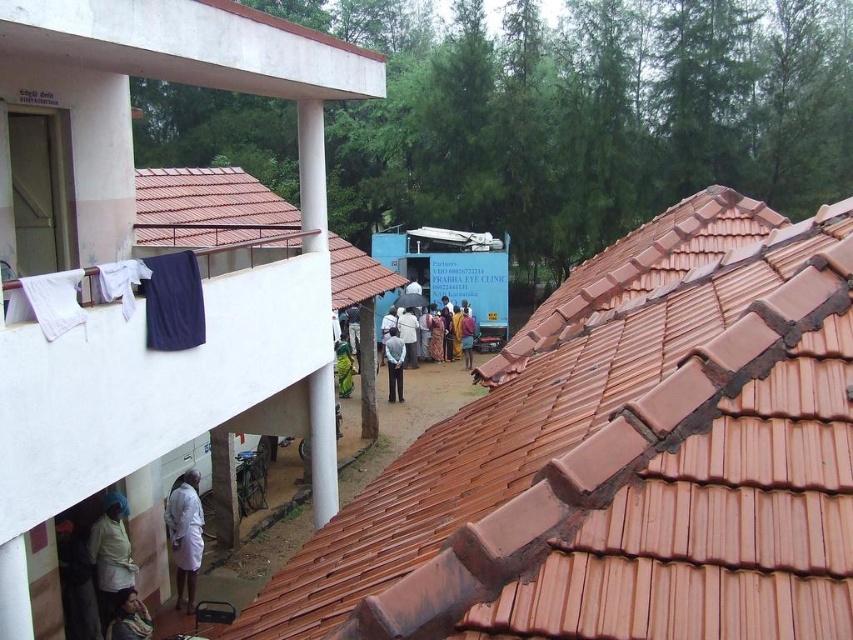
Which of these two, terracotta tile roof at upper left or white cotton dress at lower left, stands taller?

Standing taller between the two is terracotta tile roof at upper left.

Image resolution: width=853 pixels, height=640 pixels. What do you see at coordinates (212, 214) in the screenshot?
I see `terracotta tile roof at upper left` at bounding box center [212, 214].

Between point (252, 204) and point (108, 589), which one is positioned in front?

Point (108, 589) is more forward.

Where is `terracotta tile roof at upper left`? The height and width of the screenshot is (640, 853). terracotta tile roof at upper left is located at coordinates pos(212,214).

Who is positioned more to the right, light brown fabric at lower left or dark blue fabric at center?

From the viewer's perspective, dark blue fabric at center appears more on the right side.

Measure the distance between point (126, 589) and camera.

11.38 meters

Between point (132, 598) and point (467, 307), which one is positioned behind?

The point (467, 307) is more distant.

This screenshot has height=640, width=853. I want to click on light brown fabric at lower left, so click(129, 618).

Does white cotton dress at lower left have a larger size compared to light brown fabric at lower left?

Indeed, white cotton dress at lower left has a larger size compared to light brown fabric at lower left.

Who is more distant from viewer, (122,538) or (109,636)?

The point (122,538) is more distant.

Between point (112, 506) and point (114, 618), which one is positioned behind?

The point (114, 618) is behind.

Locate an element on the screen. The height and width of the screenshot is (640, 853). white cotton dress at lower left is located at coordinates (109, 554).